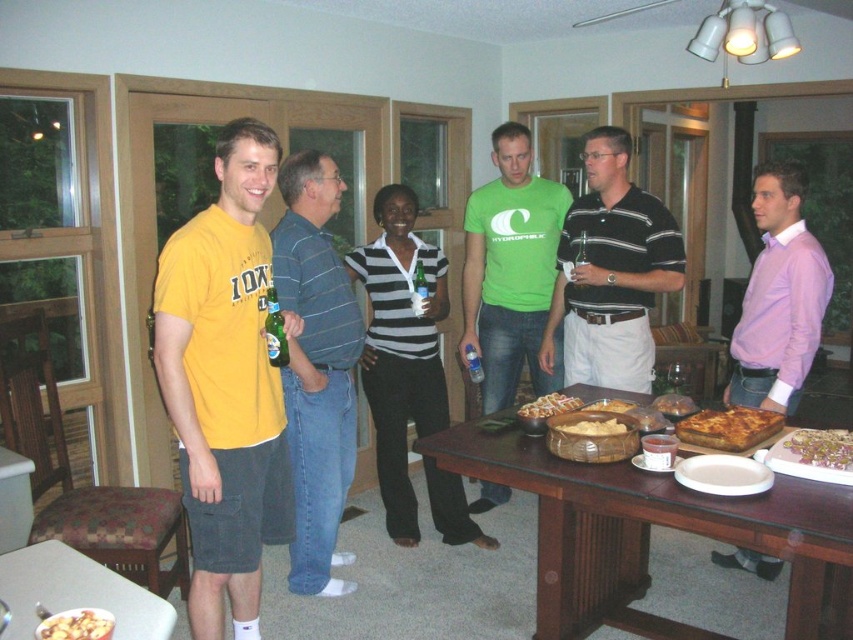
You are a photographer positioned at the back of the room and want to take a photo of the brown wooden table at center and the green matte bottle at center. Which object will appear larger in the photo?

The brown wooden table at center will appear larger in the photo because it is closer to the viewer than the green matte bottle at center.

You are planning to place a decorative plate on the table between the golden brown crusty pizza at center and the golden brown bread at table center. Considering their sizes, which object should you place the plate closer to to ensure it fits better?

The golden brown crusty pizza at center is wider than the golden brown bread at table center. Therefore, placing the decorative plate closer to the golden brown bread at table center would allow more space for the pizza on the other side.

You are planning to place a new decorative item on the brown wooden table at center. The item is slightly smaller than the green matte bottle at center. Will it fit on the table?

The brown wooden table at center is larger in size than the green matte bottle at center, so the decorative item, being smaller than the bottle, will fit on the table.